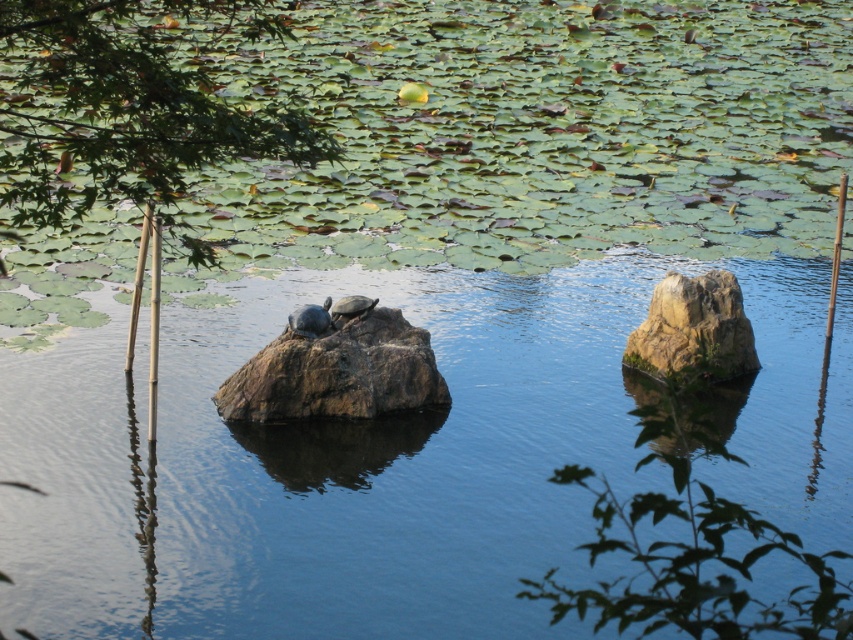
Is shiny dark green tortoise at center-left above smooth gray tortoise at center?

No.

Between shiny dark green tortoise at center-left and smooth gray tortoise at center, which one is positioned higher?

smooth gray tortoise at center is above.

Where is `shiny dark green tortoise at center-left`? The width and height of the screenshot is (853, 640). shiny dark green tortoise at center-left is located at coordinates (311, 320).

Which is more to the right, smooth beige rock at right or smooth gray tortoise at center?

From the viewer's perspective, smooth beige rock at right appears more on the right side.

What do you see at coordinates (693, 330) in the screenshot?
I see `smooth beige rock at right` at bounding box center [693, 330].

Which is behind, point (635, 348) or point (357, 305)?

Positioned behind is point (635, 348).

The height and width of the screenshot is (640, 853). Find the location of `smooth beige rock at right`. smooth beige rock at right is located at coordinates (693, 330).

Does smooth beige rock at right appear on the right side of shiny dark green tortoise at center-left?

Correct, you'll find smooth beige rock at right to the right of shiny dark green tortoise at center-left.

Which is more to the left, smooth beige rock at right or shiny dark green tortoise at center-left?

From the viewer's perspective, shiny dark green tortoise at center-left appears more on the left side.

Identify the location of smooth beige rock at right. The height and width of the screenshot is (640, 853). click(x=693, y=330).

Find the location of `smooth beige rock at right`. smooth beige rock at right is located at coordinates (693, 330).